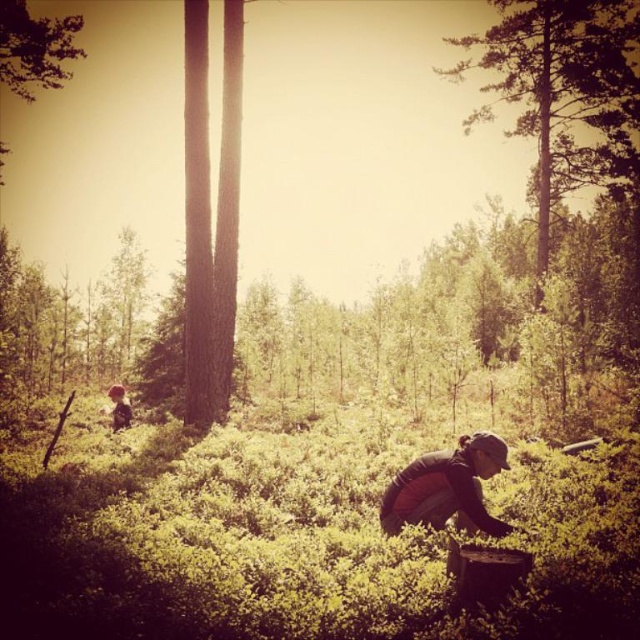
Question: Which object is the closest to the dark gray fabric at lower center?

Choices:
 (A) green leafy tree at upper right
 (B) brown fur dog at lower left
 (C) smooth bark tree at center

Answer: (C)

Question: Where is smooth bark tree at center located in relation to brown fur dog at lower left in the image?

Choices:
 (A) left
 (B) right

Answer: (B)

Question: Which point appears closest to the camera in this image?

Choices:
 (A) (120, 397)
 (B) (630, 92)
 (C) (387, 518)
 (D) (205, 276)

Answer: (C)

Question: Can you confirm if green leafy tree at upper right is positioned to the left of smooth bark tree at center?

Choices:
 (A) yes
 (B) no

Answer: (B)

Question: Considering the relative positions of green leafy tree at upper right and smooth bark tree at center in the image provided, where is green leafy tree at upper right located with respect to smooth bark tree at center?

Choices:
 (A) left
 (B) right

Answer: (B)

Question: Which point is farther to the camera?

Choices:
 (A) (224, 173)
 (B) (556, 168)

Answer: (B)